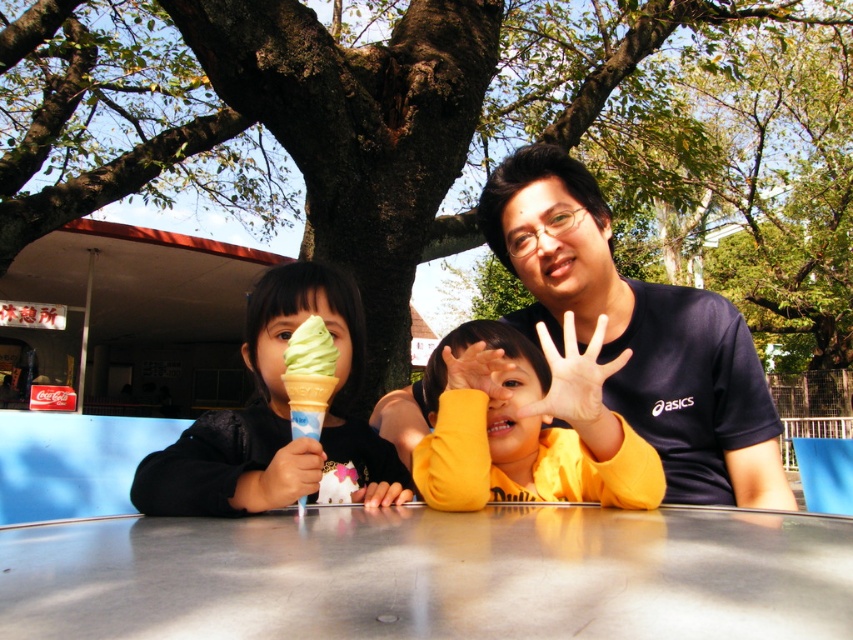
Can you confirm if dark blue t-shirt at center is thinner than yellow matte/yellowish-orange fabric at center?

No.

Who is higher up, dark blue t-shirt at center or yellow matte/yellowish-orange fabric at center?

Positioned higher is dark blue t-shirt at center.

Between point (669, 499) and point (556, 365), which one is positioned behind?

The point (669, 499) is more distant.

Where is `dark blue t-shirt at center`? dark blue t-shirt at center is located at coordinates (639, 333).

Who is more forward, (155, 573) or (316, 392)?

Point (155, 573) is in front.

Does metallic silver table at center appear under green matte ice cream cone at left?

Yes, metallic silver table at center is below green matte ice cream cone at left.

Who is more forward, (x=556, y=557) or (x=318, y=422)?

Point (x=556, y=557) is in front.

Find the location of a particular element. The image size is (853, 640). metallic silver table at center is located at coordinates (432, 573).

Between green ice cream cone at left and green matte ice cream cone at left, which one appears on the right side from the viewer's perspective?

green matte ice cream cone at left

Does green ice cream cone at left appear over green matte ice cream cone at left?

Yes.

Locate an element on the screen. green ice cream cone at left is located at coordinates (279, 419).